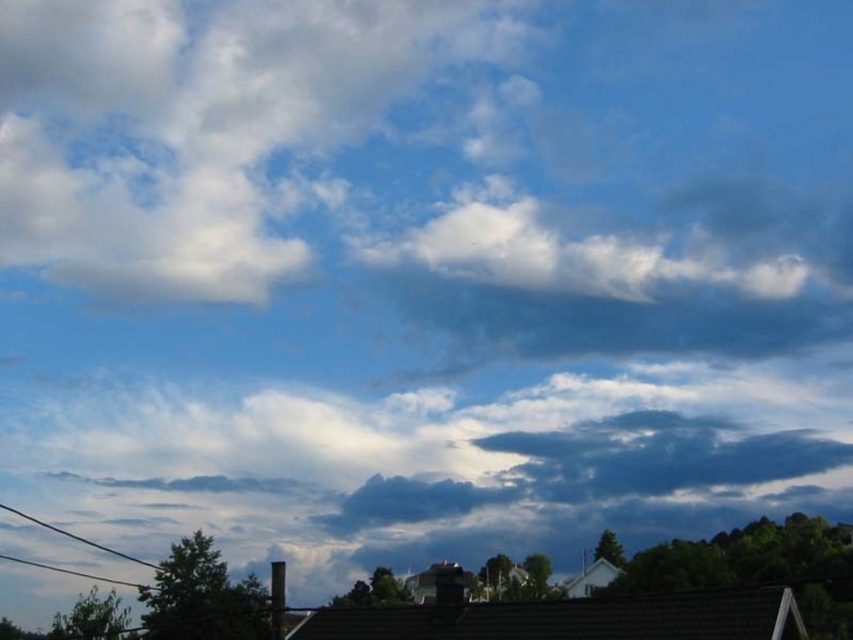
How much distance is there between white fluffy cloud at upper center and black wire at lower left?

A distance of 45.95 meters exists between white fluffy cloud at upper center and black wire at lower left.

Does white fluffy cloud at upper center have a greater width compared to black wire at lower left?

Yes.

Does point (207, 93) lie behind point (96, 548)?

That is True.

Find the location of a particular element. white fluffy cloud at upper center is located at coordinates (199, 129).